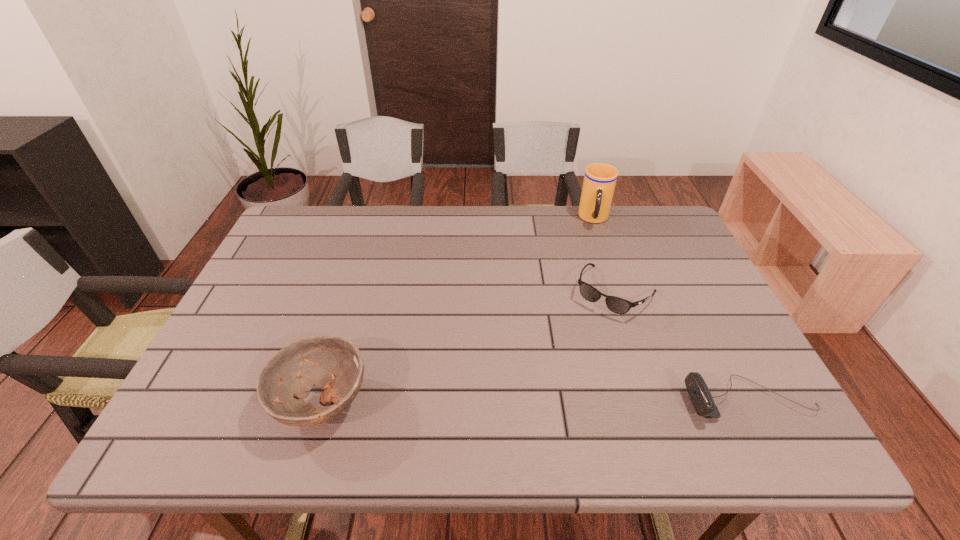
Where is `free space located 0.130m on the side of the cup with the handle`? This screenshot has width=960, height=540. free space located 0.130m on the side of the cup with the handle is located at coordinates 595,257.

Where is `free space located on the side of the cup with the handle`? The width and height of the screenshot is (960, 540). free space located on the side of the cup with the handle is located at coordinates [x=596, y=275].

Find the location of a particular element. This screenshot has width=960, height=540. free spot located 0.190m on the side of the cup with the handle is located at coordinates (596, 271).

Where is `free point located on the front-facing side of the second farthest object`? free point located on the front-facing side of the second farthest object is located at coordinates (559, 373).

In order to click on vacant space located 0.100m on the front-facing side of the second farthest object in this screenshot , I will do `click(580, 341)`.

At what (x,y) coordinates should I click in order to perform the action: click on vacant space located 0.300m on the front-facing side of the second farthest object. Please return your answer as a coordinate pair (x, y). This screenshot has height=540, width=960. Looking at the image, I should click on (539, 401).

At what (x,y) coordinates should I click in order to perform the action: click on object that is at the far edge. Please return your answer as a coordinate pair (x, y). Looking at the image, I should click on (600, 179).

Where is `bowl that is positioned at the near edge`? bowl that is positioned at the near edge is located at coordinates (332, 362).

Locate an element on the screen. Image resolution: width=960 pixels, height=540 pixels. webcam that is at the near edge is located at coordinates (698, 391).

Where is `webcam at the right edge`? This screenshot has height=540, width=960. webcam at the right edge is located at coordinates 698,391.